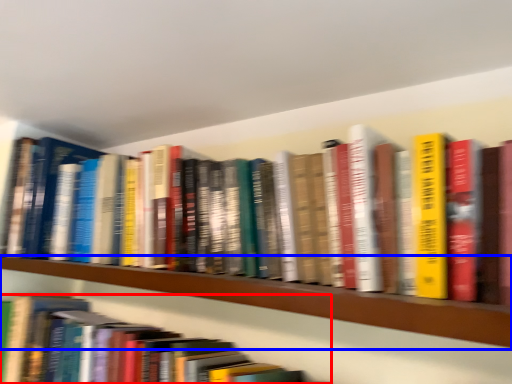
Question: Among these objects, which one is farthest to the camera, book (highlighted by a red box) or shelf (highlighted by a blue box)?

Choices:
 (A) book
 (B) shelf

Answer: (A)